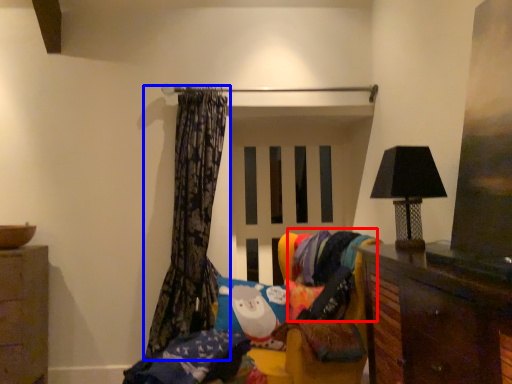
Question: Which object appears closest to the camera in this image, fabric (highlighted by a red box) or curtain (highlighted by a blue box)?

Choices:
 (A) fabric
 (B) curtain

Answer: (A)